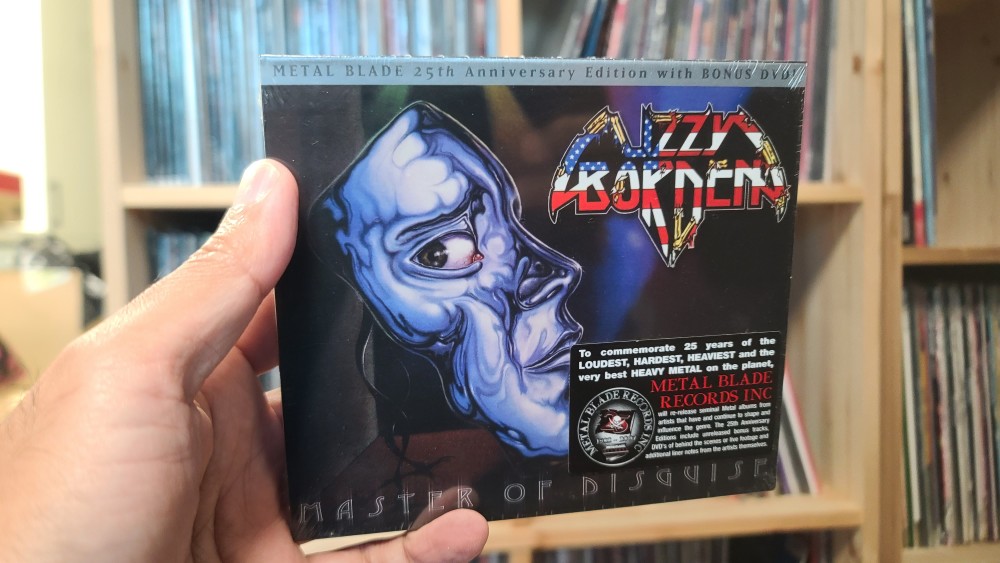
The image size is (1000, 563). What are the coordinates of `wall` in the screenshot? It's located at (75, 150).